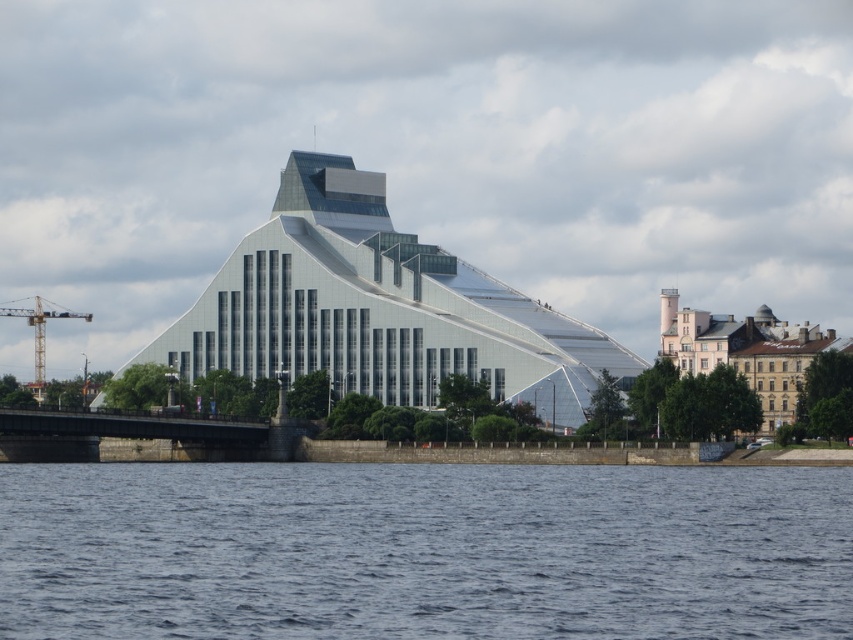
Question: Estimate the real-world distances between objects in this image. Which object is closer to the yellow metallic crane at left?

Choices:
 (A) blue water at lower center
 (B) transparent glass building at center
 (C) brown stone building at right

Answer: (B)

Question: Based on their relative distances, which object is nearer to the transparent glass building at center?

Choices:
 (A) blue water at lower center
 (B) brown stone building at right

Answer: (B)

Question: Which object is positioned closest to the blue water at lower center?

Choices:
 (A) brown stone building at right
 (B) transparent glass building at center

Answer: (A)

Question: Does blue water at lower center have a larger size compared to yellow metallic crane at left?

Choices:
 (A) no
 (B) yes

Answer: (B)

Question: Is blue water at lower center below yellow metallic crane at left?

Choices:
 (A) yes
 (B) no

Answer: (A)

Question: Does blue water at lower center come in front of transparent glass building at center?

Choices:
 (A) yes
 (B) no

Answer: (A)